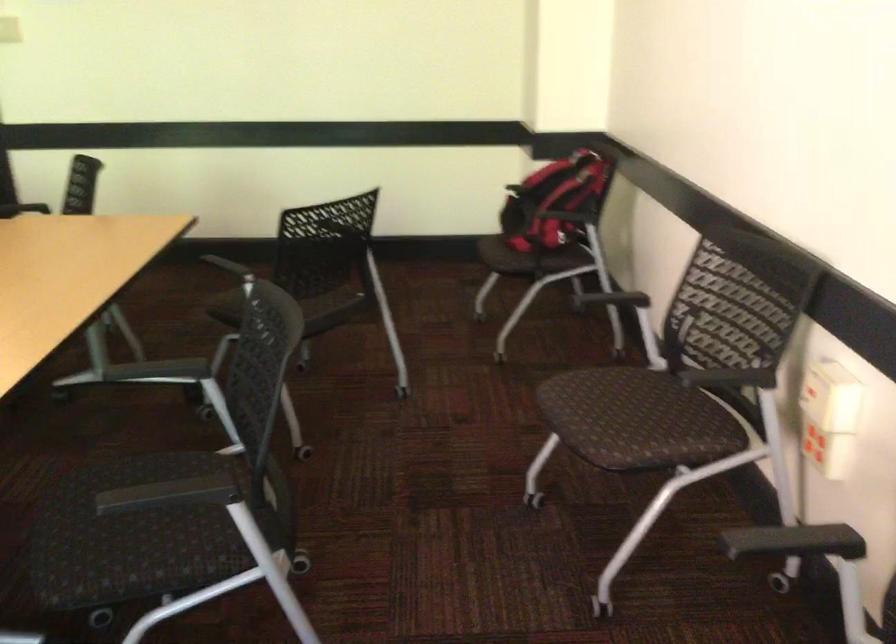
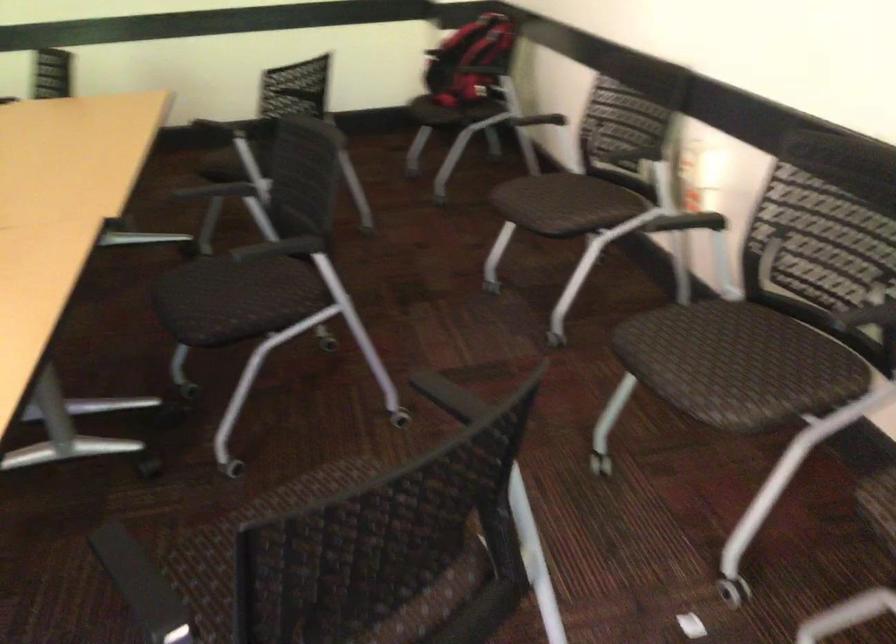
Find the pixel in the second image that matches [556,212] in the first image.

(471, 61)